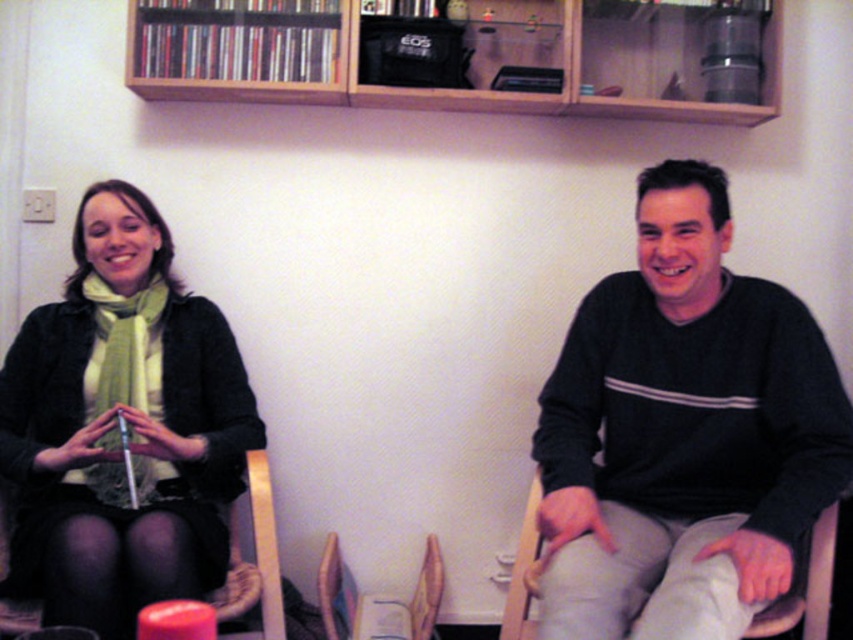
Question: Is wooden bookshelf at upper center above wooden chair at right?

Choices:
 (A) yes
 (B) no

Answer: (A)

Question: Which point appears closest to the camera in this image?

Choices:
 (A) (776, 618)
 (B) (16, 412)
 (C) (344, 595)
 (D) (686, 564)

Answer: (D)

Question: Is matte green scarf at left below wooden armchair at center?

Choices:
 (A) yes
 (B) no

Answer: (B)

Question: Can you confirm if matte green scarf at left is positioned to the left of wooden armchair at center?

Choices:
 (A) no
 (B) yes

Answer: (B)

Question: Which point is farther from the camera taking this photo?

Choices:
 (A) (401, 618)
 (B) (265, 538)

Answer: (A)

Question: Based on their relative distances, which object is nearer to the wooden chair at lower left?

Choices:
 (A) wooden armchair at center
 (B) wooden bookshelf at upper center

Answer: (A)